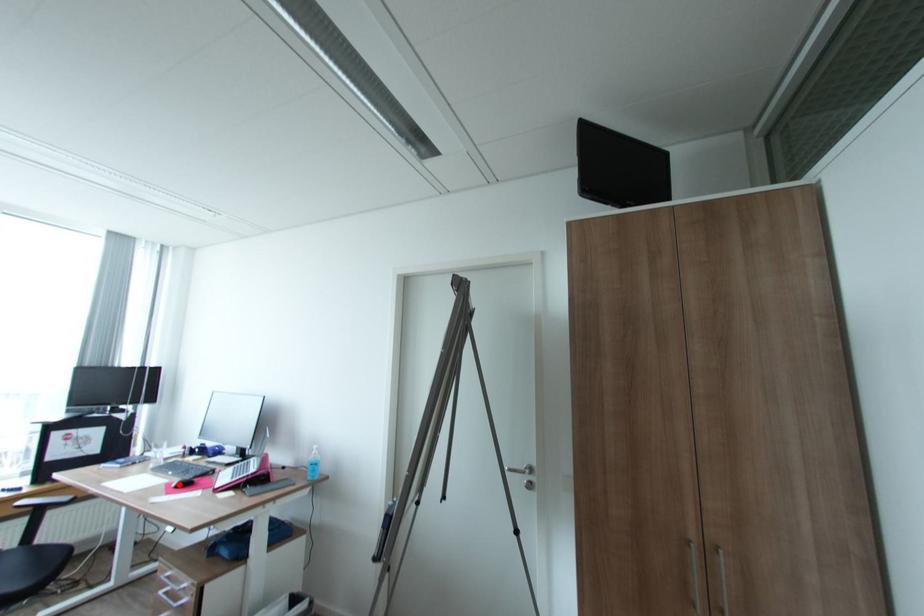
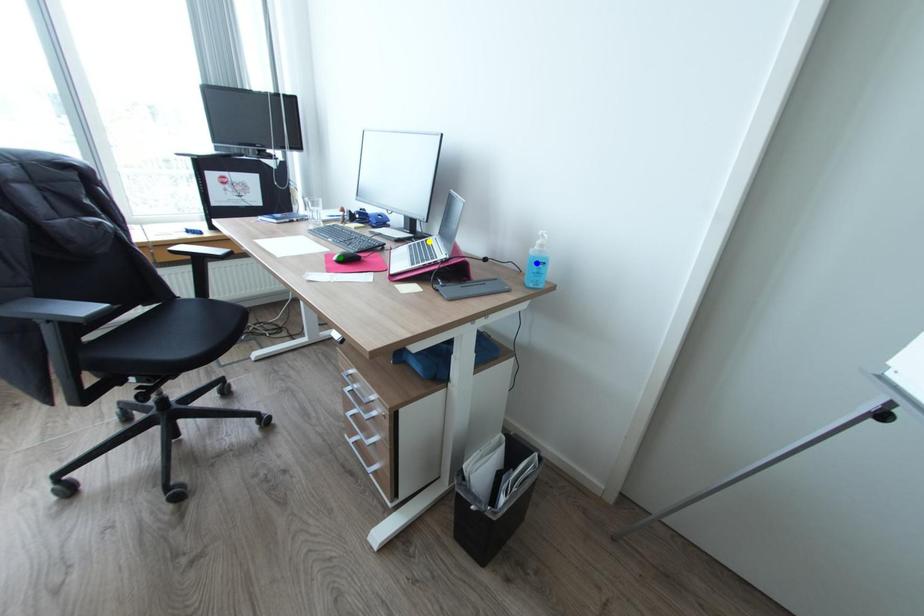
Question: I am providing you with two images of the same scene from different viewpoints. A red point is marked on the first image. You are given multiple points on the second image. Can you choose the point in image 2 that corresponds to the point in image 1?

Choices:
 (A) yellow point
 (B) blue point
 (C) green point

Answer: (C)